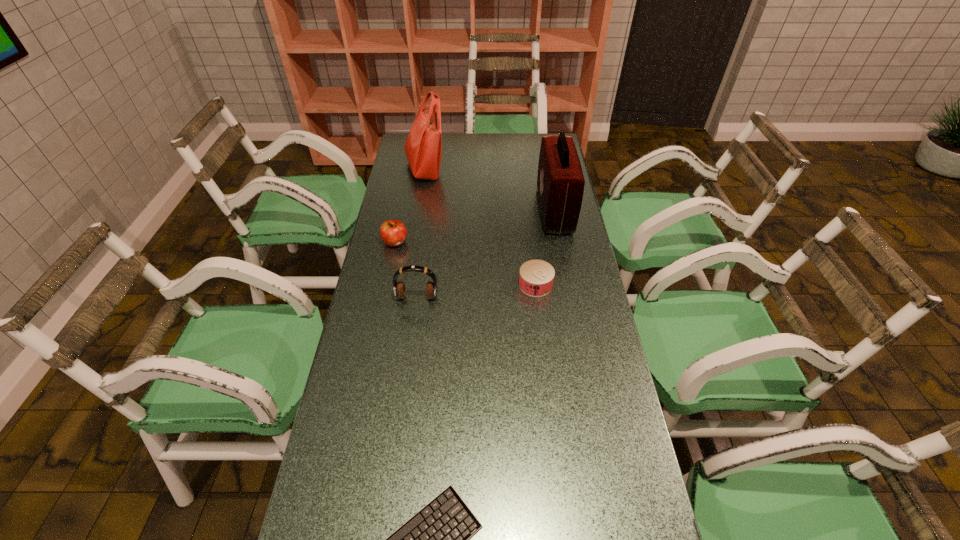
The image size is (960, 540). In order to click on vacant position in the image that satisfies the following two spatial constraints: 1. on the side of the first aid kit with the cross symbol; 2. on the ear cup of the headset in this screenshot , I will do `click(571, 297)`.